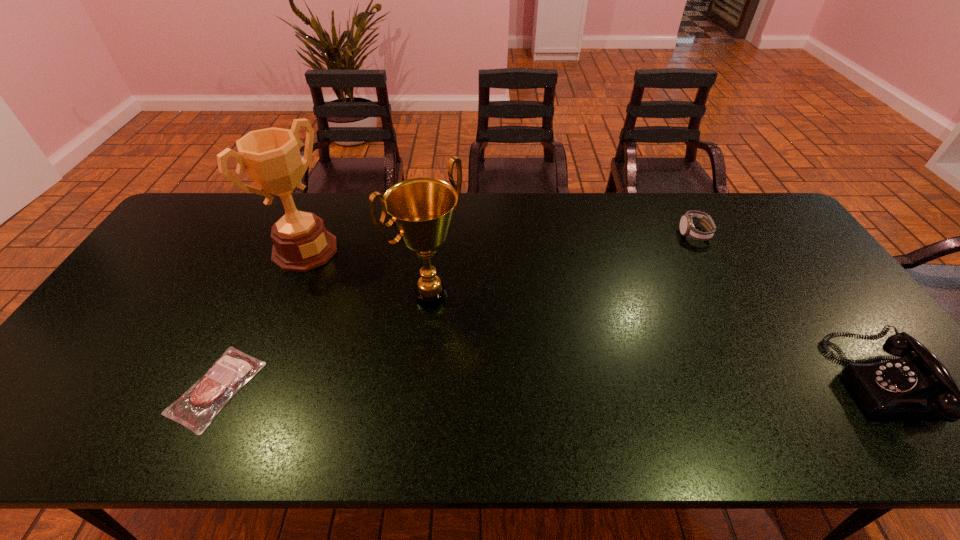
Identify the location of free space at the right edge. (828, 296).

I want to click on vacant space at the far left corner of the desktop, so click(232, 201).

The width and height of the screenshot is (960, 540). In the image, there is a desktop. What are the coordinates of `vacant space at the near left corner` in the screenshot? It's located at (90, 394).

Where is `vacant area that lies between the second object from right to left and the third object from right to left`? Image resolution: width=960 pixels, height=540 pixels. vacant area that lies between the second object from right to left and the third object from right to left is located at coordinates (563, 265).

At what (x,y) coordinates should I click in order to perform the action: click on vacant point located between the right award and the left award. Please return your answer as a coordinate pair (x, y). The height and width of the screenshot is (540, 960). Looking at the image, I should click on (368, 273).

This screenshot has width=960, height=540. Find the location of `vacant space that is in between the left award and the shortest object`. vacant space that is in between the left award and the shortest object is located at coordinates (261, 319).

In order to click on empty space between the second shortest object and the left award in this screenshot , I will do `click(499, 242)`.

Identify the location of free space between the fourth tallest object and the left award. The height and width of the screenshot is (540, 960). (499, 242).

Find the location of a particular element. free space between the watch and the shortest object is located at coordinates (455, 310).

Locate an element on the screen. vacant area that lies between the third object from left to right and the left award is located at coordinates (368, 273).